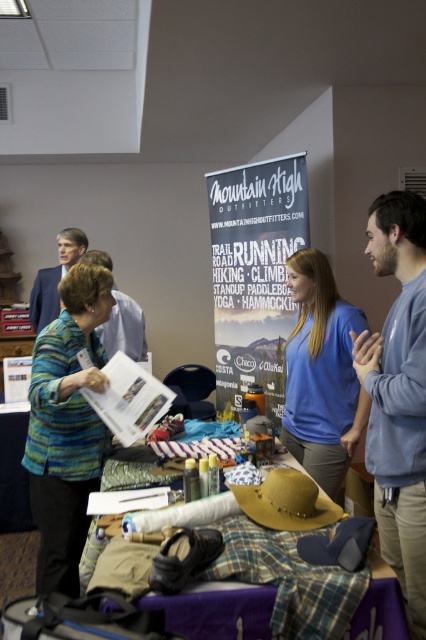
Does plaid fabric at center have a larger size compared to blue cotton shirt at center?

Correct, plaid fabric at center is larger in size than blue cotton shirt at center.

Is point (264, 580) farther from camera compared to point (287, 353)?

That is False.

What do you see at coordinates (305, 586) in the screenshot? The image size is (426, 640). I see `plaid fabric at center` at bounding box center [305, 586].

Image resolution: width=426 pixels, height=640 pixels. Identify the location of plaid fabric at center. (305, 586).

Between point (68, 362) and point (112, 285), which one is positioned behind?

The point (112, 285) is behind.

Can you confirm if striped wool sweater at center is wider than matte gray shirt at center?

In fact, striped wool sweater at center might be narrower than matte gray shirt at center.

Locate an element on the screen. striped wool sweater at center is located at coordinates (66, 426).

Identify the location of striped wool sweater at center. This screenshot has height=640, width=426. (66, 426).

Can you confirm if striped wool sweater at center is positioned above plaid fabric at center?

Yes.

From the picture: Is striped wool sweater at center below plaid fabric at center?

Incorrect, striped wool sweater at center is not positioned below plaid fabric at center.

Between point (40, 525) and point (380, 637), which one is positioned behind?

Point (40, 525)

Where is `striped wool sweater at center`? The height and width of the screenshot is (640, 426). striped wool sweater at center is located at coordinates (66, 426).